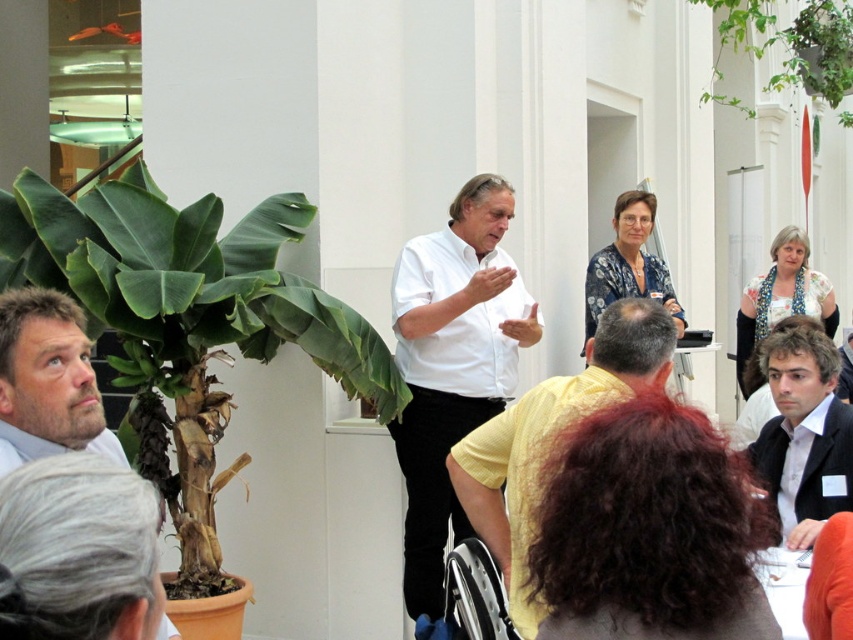
In the scene shown: You are organizing a small event and need to ensure there is enough space for both the green leafy plant at left and the white matte shirt at center. Based on their sizes, which one requires more space?

The green leafy plant at left requires more space because it is bigger than the white matte shirt at center.

Where is the white matte shirt at center located in the image?

The white matte shirt at center is located at point coordinates of 0.572 on the x axis and 0.531 on the y axis.